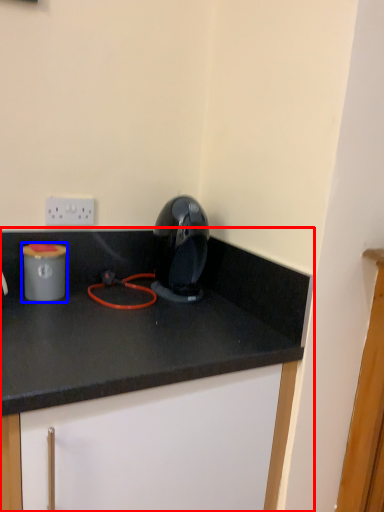
Question: Which object appears farthest to the camera in this image, cabinetry (highlighted by a red box) or appliance (highlighted by a blue box)?

Choices:
 (A) cabinetry
 (B) appliance

Answer: (B)